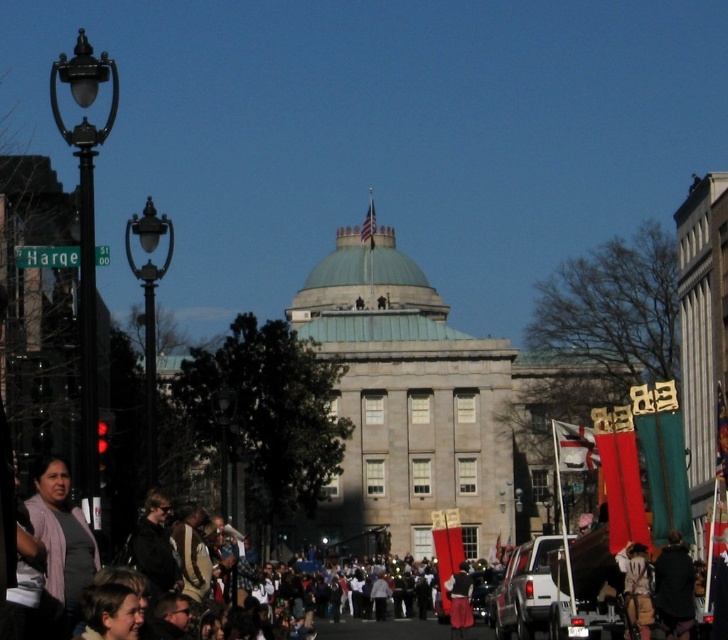
Question: Can you confirm if dark brown leather jacket at lower right is positioned below red fabric skirt at center?

Choices:
 (A) yes
 (B) no

Answer: (B)

Question: Is dark brown leather jacket at lower right bigger than light brown hair at lower left?

Choices:
 (A) no
 (B) yes

Answer: (A)

Question: Can you confirm if pink fabric at lower left is wider than white fabric flag at center?

Choices:
 (A) yes
 (B) no

Answer: (B)

Question: Which object is the closest to the white matte truck at lower center?

Choices:
 (A) dark brown leather jacket at lower right
 (B) pink fabric at lower left
 (C) white fabric flag at center
 (D) camouflage fabric jacket at lower right

Answer: (C)

Question: Based on their relative distances, which object is farther from the red fabric skirt at center?

Choices:
 (A) dark brown leather jacket at lower right
 (B) white matte truck at lower center

Answer: (A)

Question: Which of the following is the closest to the observer?

Choices:
 (A) camouflage fabric jacket at lower right
 (B) light brown hair at lower left
 (C) white matte truck at lower center

Answer: (B)